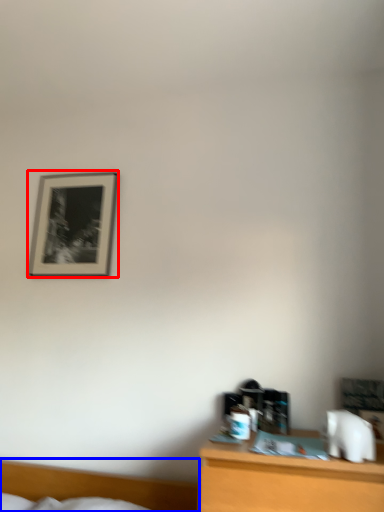
Question: Which point is further to the camera, picture frame (highlighted by a red box) or bed (highlighted by a blue box)?

Choices:
 (A) picture frame
 (B) bed

Answer: (A)